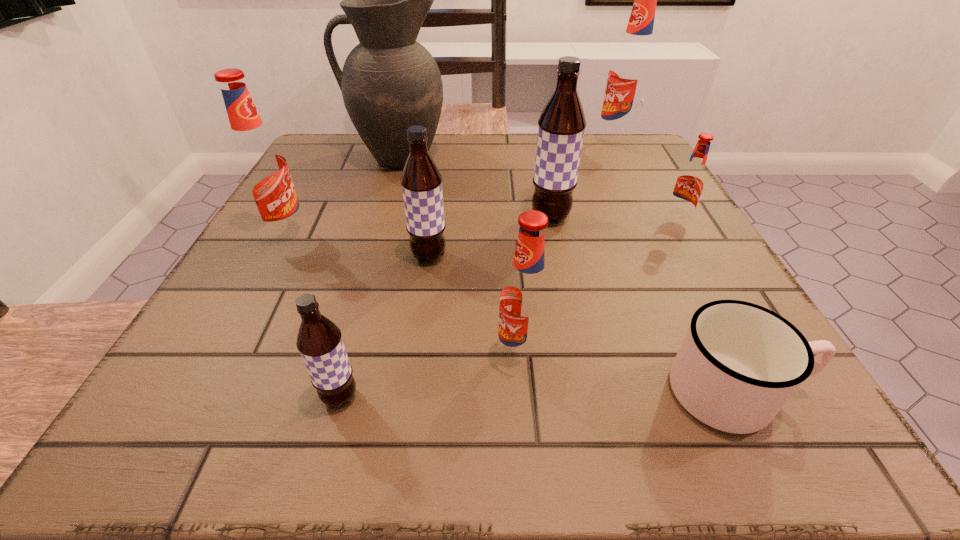
Choose which object is the fourth nearest neighbor to the second nearest brown root beer. Please provide its 2D coordinates. Your answer should be formatted as a tuple, i.e. [(x, y)], where the tuple contains the x and y coordinates of a point satisfying the conditions above.

[(319, 341)]

The image size is (960, 540). What are the coordinates of `root beer that is the fourth closest to the tallest root beer` in the screenshot? It's located at pyautogui.click(x=525, y=304).

Locate which root beer is the closest to the pitcher. Please provide its 2D coordinates. Your answer should be formatted as a tuple, i.e. [(x, y)], where the tuple contains the x and y coordinates of a point satisfying the conditions above.

[(260, 165)]

Locate an element on the screen. the closest red root beer to the smallest red root beer is located at coordinates (631, 70).

Locate which red root beer ranks fourth in proximity to the pitcher. Please provide its 2D coordinates. Your answer should be formatted as a tuple, i.e. [(x, y)], where the tuple contains the x and y coordinates of a point satisfying the conditions above.

[(525, 304)]

Identify which brown root beer is located as the third nearest to the shortest object. Please provide its 2D coordinates. Your answer should be formatted as a tuple, i.e. [(x, y)], where the tuple contains the x and y coordinates of a point satisfying the conditions above.

[(319, 341)]

Point out which brown root beer is positioned as the second nearest to the third root beer from left to right. Please provide its 2D coordinates. Your answer should be formatted as a tuple, i.e. [(x, y)], where the tuple contains the x and y coordinates of a point satisfying the conditions above.

[(319, 341)]

Where is `vacant space that satisfies the following two spatial constraints: 1. on the side of the fourth object from right to left with the handle; 2. on the right side of the pitcher`? Image resolution: width=960 pixels, height=540 pixels. vacant space that satisfies the following two spatial constraints: 1. on the side of the fourth object from right to left with the handle; 2. on the right side of the pitcher is located at coordinates (380, 218).

Identify the location of free space that satisfies the following two spatial constraints: 1. on the front side of the smallest red root beer; 2. on the side of the shortest object with the handle. (775, 392).

You are a GUI agent. You are given a task and a screenshot of the screen. Output one action in this format:
    pyautogui.click(x=<x>, y=<y>)
    Task: Click on the vacant area that satisfies the following two spatial constraints: 1. on the back side of the fifth root beer from right to left; 2. on the left side of the smallest red root beer
    The height and width of the screenshot is (540, 960).
    Given the screenshot: What is the action you would take?
    pyautogui.click(x=434, y=221)